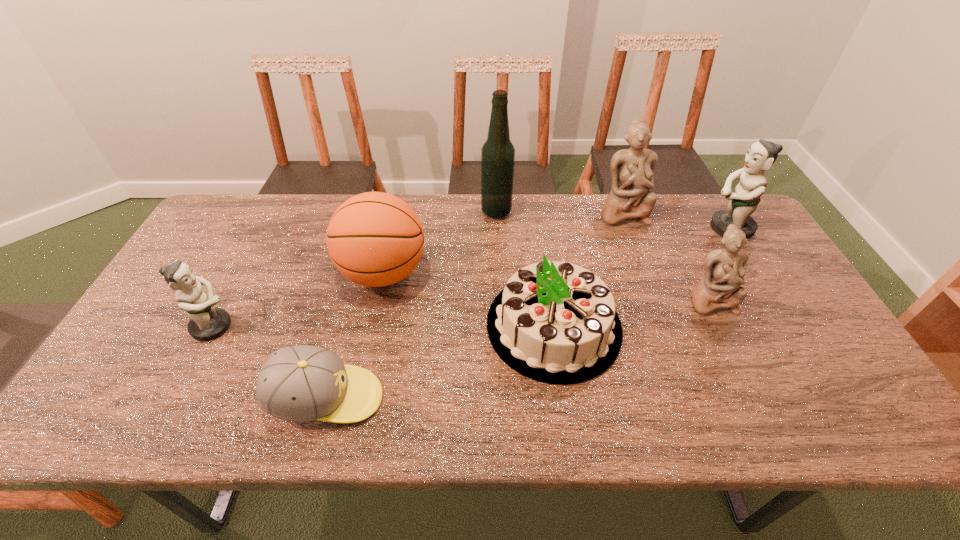
Locate an element on the screen. The width and height of the screenshot is (960, 540). vacant space located on the left of the green birthday cake is located at coordinates (437, 326).

Locate an element on the screen. This screenshot has height=540, width=960. free space located on the front-facing side of the smaller white figurine is located at coordinates (775, 434).

Locate an element on the screen. vacant space located 0.140m on the front-facing side of the left green figurine is located at coordinates (291, 327).

This screenshot has height=540, width=960. Find the location of `free location located 0.080m on the front-facing side of the shortest object`. free location located 0.080m on the front-facing side of the shortest object is located at coordinates (418, 398).

Where is `alcohol present at the far edge`? The image size is (960, 540). alcohol present at the far edge is located at coordinates (498, 153).

Where is `object at the near edge`? This screenshot has height=540, width=960. object at the near edge is located at coordinates coord(303,383).

The image size is (960, 540). I want to click on object present at the left edge, so click(207, 322).

You are a GUI agent. You are given a task and a screenshot of the screen. Output one action in this format:
    pyautogui.click(x=<x>, y=<y>)
    Task: Click on the object located at the right edge
    
    Given the screenshot: What is the action you would take?
    (761, 155)

Where is `object present at the far right corner`? Image resolution: width=960 pixels, height=540 pixels. object present at the far right corner is located at coordinates click(x=761, y=155).

Where is `vacant space at the far edge`? Image resolution: width=960 pixels, height=540 pixels. vacant space at the far edge is located at coordinates (445, 200).